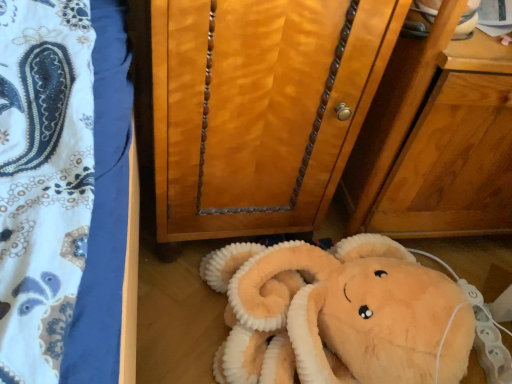
Question: From their relative heights in the image, would you say wooden cabinet at center is taller or shorter than soft plush toy at lower center?

Choices:
 (A) short
 (B) tall

Answer: (B)

Question: Is wooden cabinet at center inside the boundaries of soft plush toy at lower center, or outside?

Choices:
 (A) outside
 (B) inside

Answer: (A)

Question: From the image's perspective, is wooden cabinet at center positioned above or below soft plush toy at lower center?

Choices:
 (A) below
 (B) above

Answer: (B)

Question: From a real-world perspective, is soft plush toy at lower center above or below wooden cabinet at center?

Choices:
 (A) below
 (B) above

Answer: (A)

Question: From the image's perspective, relative to wooden cabinet at center, is soft plush toy at lower center above or below?

Choices:
 (A) below
 (B) above

Answer: (A)

Question: Based on their sizes in the image, would you say soft plush toy at lower center is bigger or smaller than wooden cabinet at center?

Choices:
 (A) big
 (B) small

Answer: (B)

Question: In terms of width, does soft plush toy at lower center look wider or thinner when compared to wooden cabinet at center?

Choices:
 (A) wide
 (B) thin

Answer: (A)